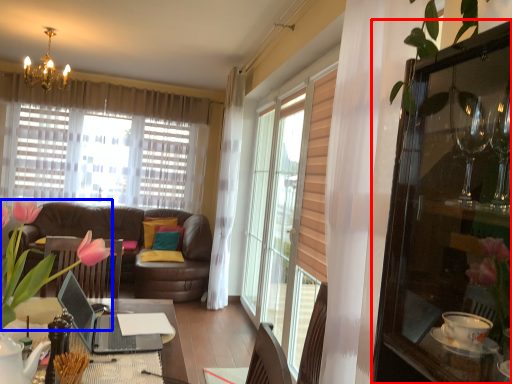
Question: Which object is closer to the camera taking this photo, cabinetry (highlighted by a red box) or floral arrangement (highlighted by a blue box)?

Choices:
 (A) cabinetry
 (B) floral arrangement

Answer: (A)